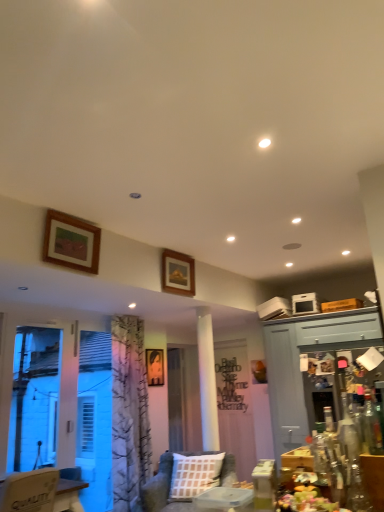
Identify the location of matte blue cabinet at right, the second screen door in the right-to-left sequence. This screenshot has height=512, width=384. (285, 388).

Where is `matte wooden picture frame at center, positioned as the second picture frame in left-to-right order`? Image resolution: width=384 pixels, height=512 pixels. matte wooden picture frame at center, positioned as the second picture frame in left-to-right order is located at coordinates (155, 366).

Identify the location of transparent glass bottle at lower right. This screenshot has height=512, width=384. (372, 426).

The image size is (384, 512). What do you see at coordinates (372, 426) in the screenshot?
I see `transparent glass bottle at lower right` at bounding box center [372, 426].

Locate an element on the screen. matte blue cabinet at right, the second screen door in the right-to-left sequence is located at coordinates (285, 388).

Looking at this image, which is nearer, (380, 445) or (97, 263)?

Point (380, 445)

Could you tell me if transparent glass bottle at lower right is facing wooden frame at upper left, which is the first picture frame from left to right?

No, transparent glass bottle at lower right is not turned towards wooden frame at upper left, which is the first picture frame from left to right.

Is transparent glass bottle at lower right not near wooden frame at upper left, which is the first picture frame from front to back?

Yes, transparent glass bottle at lower right is far from wooden frame at upper left, which is the first picture frame from front to back.

From the image's perspective, is transparent glass bottle at lower right over wooden frame at upper left, placed as the 1th picture frame when sorted from top to bottom?

No, from the image's perspective, transparent glass bottle at lower right is not over wooden frame at upper left, placed as the 1th picture frame when sorted from top to bottom.

Is wooden chair at lower left facing towards wooden table at lower right?

No, wooden chair at lower left is not facing towards wooden table at lower right.

The width and height of the screenshot is (384, 512). Find the location of `chair below the wooden table at lower right (from a real-world perspective)`. chair below the wooden table at lower right (from a real-world perspective) is located at coordinates (30, 490).

Does wooden chair at lower left appear on the right side of wooden table at lower right?

Incorrect, wooden chair at lower left is not on the right side of wooden table at lower right.

Can you tell me how much wooden chair at lower left and wooden table at lower right differ in facing direction?

The facing directions of wooden chair at lower left and wooden table at lower right are 90 degrees apart.

Can you confirm if matte blue cabinet at right, the 3th screen door viewed from the front, is thinner than metallic silver screen door at right, marked as the 1th screen door in a right-to-left arrangement?

No.

Identify the location of screen door that is the 1st one when counting forward from the matte blue cabinet at right, placed as the 2th screen door when sorted from back to front. The width and height of the screenshot is (384, 512). (332, 381).

Which is more to the right, matte blue cabinet at right, which is the 3th screen door in left-to-right order, or metallic silver screen door at right, which appears as the 2th screen door when viewed from the front?

From the viewer's perspective, metallic silver screen door at right, which appears as the 2th screen door when viewed from the front, appears more on the right side.

Is matte blue cabinet at right, placed as the 2th screen door when sorted from back to front, bigger than metallic silver screen door at right, the 4th screen door from the left?

Yes.

From the picture: Considering the relative sizes of textured beige couch at center and wooden chair at lower left in the image provided, is textured beige couch at center shorter than wooden chair at lower left?

No, textured beige couch at center is not shorter than wooden chair at lower left.

Is wooden chair at lower left a part of textured beige couch at center?

Definitely not — wooden chair at lower left is not inside textured beige couch at center.

From the image's perspective, is textured beige couch at center on top of wooden chair at lower left?

Incorrect, from the image's perspective, textured beige couch at center is lower than wooden chair at lower left.

Which of these two, textured beige couch at center or wooden chair at lower left, is thinner?

Thinner between the two is wooden chair at lower left.

Consider the image. How much distance is there between wooden frame at upper left, placed as the 1th picture frame when sorted from top to bottom, and wooden table at lower right?

7.64 feet.

From the image's perspective, is wooden frame at upper left, the third picture frame from the bottom, above wooden table at lower right?

Correct, wooden frame at upper left, the third picture frame from the bottom, appears higher than wooden table at lower right in the image.

Looking at this image, which is correct: wooden frame at upper left, the third picture frame from the bottom, is inside wooden table at lower right, or outside of it?

wooden frame at upper left, the third picture frame from the bottom, exists outside the volume of wooden table at lower right.

Between textured beige couch at center and wooden frame at upper left, placed as the 1th picture frame when sorted from top to bottom, which one has smaller width?

wooden frame at upper left, placed as the 1th picture frame when sorted from top to bottom, is thinner.

Find the location of `picture frame that is the 3rd one when counting upward from the textured beige couch at center (from the image's perspective)`. picture frame that is the 3rd one when counting upward from the textured beige couch at center (from the image's perspective) is located at coordinates (71, 242).

Does point (225, 462) come closer to viewer compared to point (86, 242)?

No.

The height and width of the screenshot is (512, 384). In order to click on studio couch below the white plastic screen door at lower left, positioned as the fourth screen door in back-to-front order (from the image's perspective) in this screenshot , I will do `click(158, 486)`.

Is textured beige couch at center situated inside white plastic screen door at lower left, the fourth screen door viewed from the right, or outside?

textured beige couch at center is spatially situated outside white plastic screen door at lower left, the fourth screen door viewed from the right.

From the image's perspective, which is above, textured beige couch at center or white plastic screen door at lower left, the fourth screen door viewed from the right?

white plastic screen door at lower left, the fourth screen door viewed from the right, is shown above in the image.

The height and width of the screenshot is (512, 384). I want to click on bottle below the wooden frame at upper left, which ranks as the third picture frame in back-to-front order (from the image's perspective), so click(x=372, y=426).

The image size is (384, 512). I want to click on table in front of the wooden chair at lower left, so click(374, 479).

From the image, which object appears to be nearer to textured beige couch at center, matte blue cabinet at right, placed as the 2th screen door when sorted from back to front, or transparent glass bottle at lower right?

matte blue cabinet at right, placed as the 2th screen door when sorted from back to front, is positioned closer to the anchor textured beige couch at center.

Estimate the real-world distances between objects in this image. Which object is closer to wooden frame at upper left, which is the first picture frame from left to right, transparent glass bottle at lower right or transparent plastic screen door at center, acting as the 3th screen door starting from the right?

transparent glass bottle at lower right.

Which object lies further to the anchor point wooden table at lower right, matte blue cabinet at right, the 3th screen door viewed from the front, or transparent glass bottle at lower right?

matte blue cabinet at right, the 3th screen door viewed from the front.

Which object lies nearer to the anchor point transparent glass bottle at lower right, wooden picture frame at upper center, the 2th picture frame positioned from the front, or textured beige couch at center?

wooden picture frame at upper center, the 2th picture frame positioned from the front, is positioned closer to the anchor transparent glass bottle at lower right.

Based on their spatial positions, is wooden frame at upper left, which ranks as the third picture frame in back-to-front order, or textured beige couch at center closer to metallic silver screen door at right, marked as the 1th screen door in a right-to-left arrangement?

textured beige couch at center is closer to metallic silver screen door at right, marked as the 1th screen door in a right-to-left arrangement.

Which object lies further to the anchor point white plastic screen door at lower left, marked as the 1th screen door in a front-to-back arrangement, transparent plastic screen door at center, placed as the 2th screen door when sorted from left to right, or wooden table at lower right?

The object further to white plastic screen door at lower left, marked as the 1th screen door in a front-to-back arrangement, is wooden table at lower right.

Considering their positions, is transparent glass bottle at lower right positioned further to matte blue cabinet at right, the 3th screen door viewed from the front, than transparent plastic screen door at center, acting as the 3th screen door starting from the right?

transparent glass bottle at lower right is positioned further to the anchor matte blue cabinet at right, the 3th screen door viewed from the front.

Which object lies further to the anchor point metallic silver screen door at right, which appears as the 2th screen door when viewed from the front, wooden frame at upper left, which is the first picture frame from left to right, or white plastic screen door at lower left, positioned as the fourth screen door in back-to-front order?

wooden frame at upper left, which is the first picture frame from left to right, lies further to metallic silver screen door at right, which appears as the 2th screen door when viewed from the front, than the other object.

Where is `studio couch between wooden table at lower right and matte wooden picture frame at center, the second picture frame viewed from the right, along the z-axis`? The image size is (384, 512). studio couch between wooden table at lower right and matte wooden picture frame at center, the second picture frame viewed from the right, along the z-axis is located at coordinates pyautogui.click(x=158, y=486).

The image size is (384, 512). Identify the location of screen door located between metallic silver screen door at right, marked as the 1th screen door in a right-to-left arrangement, and transparent plastic screen door at center, the fourth screen door positioned from the front, in the depth direction. (285, 388).

Find the location of a particular element. This screenshot has height=512, width=384. table between wooden chair at lower left and metallic silver screen door at right, marked as the 1th screen door in a right-to-left arrangement, in the horizontal direction is located at coordinates (374, 479).

Identify the location of bottle between wooden frame at upper left, the third picture frame from the bottom, and textured beige couch at center, in the vertical direction. (372, 426).